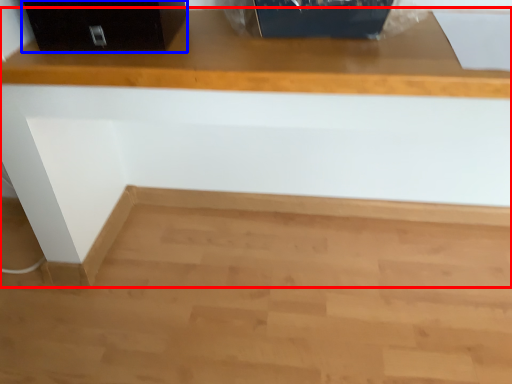
Question: Among these objects, which one is nearest to the camera, furniture (highlighted by a red box) or file cabinet (highlighted by a blue box)?

Choices:
 (A) furniture
 (B) file cabinet

Answer: (A)